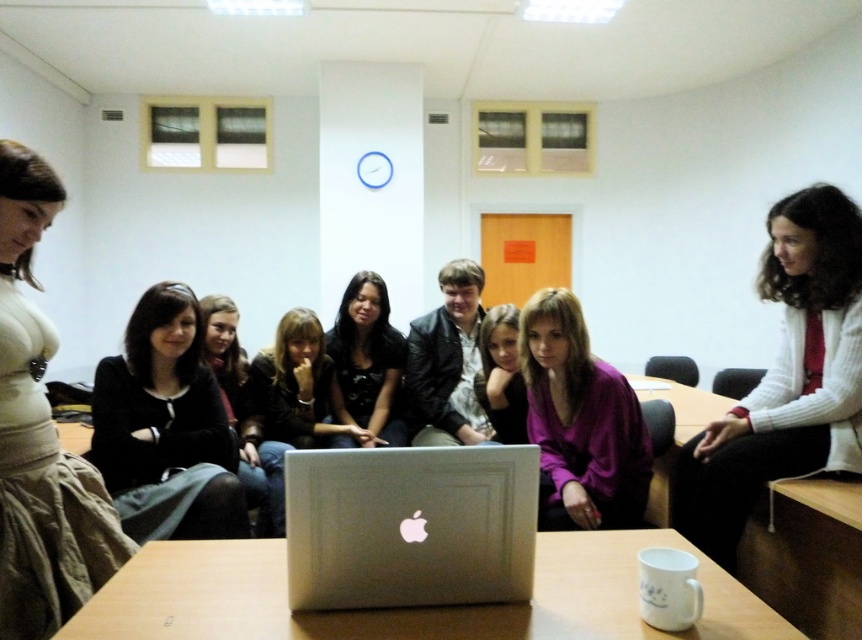
Describe the element at coordinates (41, 436) in the screenshot. The width and height of the screenshot is (862, 640). I see `white textured sweater at left` at that location.

Between white textured sweater at left and black matte skirt at lower left, which one has less height?

black matte skirt at lower left

Which is behind, point (59, 540) or point (169, 484)?

Point (169, 484)

You are a GUI agent. You are given a task and a screenshot of the screen. Output one action in this format:
    pyautogui.click(x=<x>, y=<y>)
    Task: Click on the white textured sweater at left
    The height and width of the screenshot is (640, 862).
    Given the screenshot: What is the action you would take?
    pyautogui.click(x=41, y=436)

Can you confirm if wooden table at center is positioned to the right of black matte skirt at lower left?

Yes, wooden table at center is to the right of black matte skirt at lower left.

Who is shorter, wooden table at center or black matte skirt at lower left?

wooden table at center is shorter.

Is point (720, 600) positioned behind point (104, 410)?

No, it is in front of (104, 410).

Where is `wooden table at center`? The width and height of the screenshot is (862, 640). wooden table at center is located at coordinates (409, 608).

Between point (186, 432) and point (273, 344), which one is positioned in front?

Point (186, 432)

Does point (197, 362) come farther from viewer compared to point (261, 394)?

No, (197, 362) is in front of (261, 394).

Does point (157, 381) lie behind point (328, 358)?

No, it is in front of (328, 358).

Where is `black matte skirt at lower left`? black matte skirt at lower left is located at coordinates (166, 428).